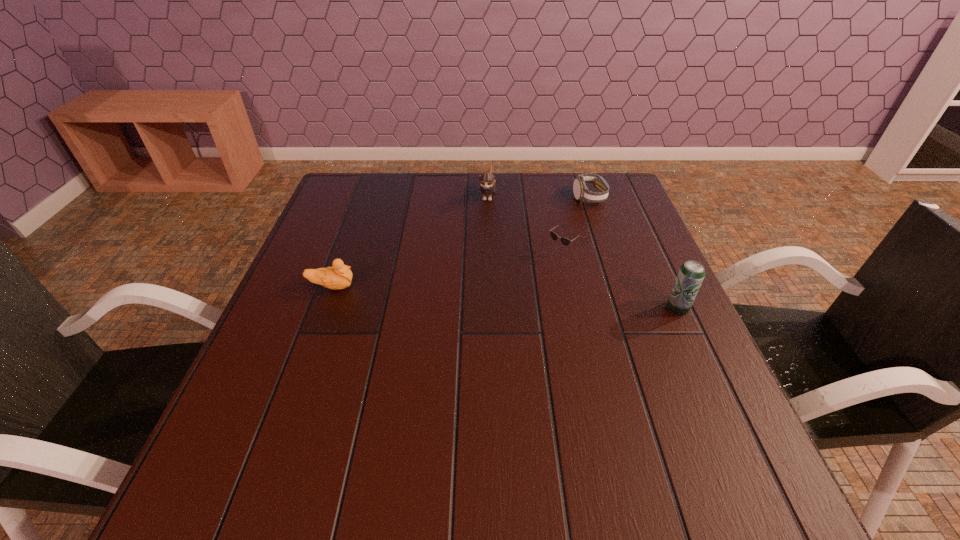
Locate an element on the screen. empty space between the duckling and the fourth object from left to right is located at coordinates (461, 242).

Where is `free space between the second object from right to left and the nearest object`? This screenshot has height=540, width=960. free space between the second object from right to left and the nearest object is located at coordinates (634, 253).

Where is `unoccupied position between the leftmost object and the fourth shortest object`? The image size is (960, 540). unoccupied position between the leftmost object and the fourth shortest object is located at coordinates pyautogui.click(x=410, y=241).

Identify which object is located as the nearest to the fourth shortest object. Please provide its 2D coordinates. Your answer should be formatted as a tuple, i.e. [(x, y)], where the tuple contains the x and y coordinates of a point satisfying the conditions above.

[(565, 241)]

Where is `object that is the second nearest to the watch`? object that is the second nearest to the watch is located at coordinates (487, 181).

The image size is (960, 540). In order to click on free region that satisfies the following two spatial constraints: 1. on the front side of the nearest object; 2. on the left side of the sunglasses in this screenshot , I will do `click(569, 308)`.

The width and height of the screenshot is (960, 540). Identify the location of vacant point that satisfies the following two spatial constraints: 1. on the front side of the kitten; 2. on the left side of the third nearest object. (489, 253).